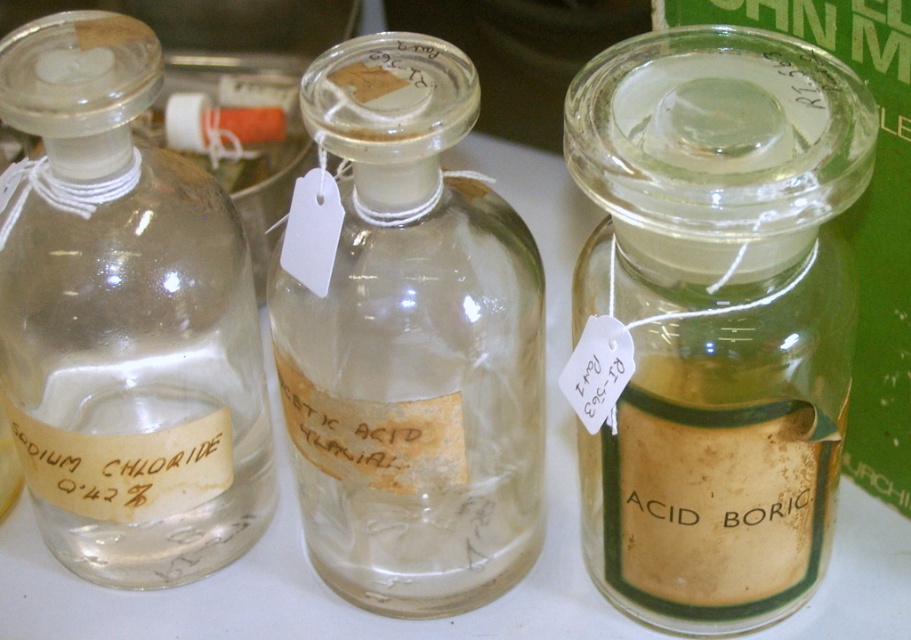
Which is more to the right, transparent glass jar at center or transparent glass bottle at center?

transparent glass jar at center is more to the right.

Who is lower down, transparent glass jar at center or transparent glass bottle at center?

transparent glass jar at center is lower down.

You are a GUI agent. You are given a task and a screenshot of the screen. Output one action in this format:
    pyautogui.click(x=<x>, y=<y>)
    Task: Click on the transparent glass jar at center
    Image resolution: width=911 pixels, height=640 pixels.
    Given the screenshot: What is the action you would take?
    pyautogui.click(x=712, y=317)

Which of these two, transparent glass bottle at center or transparent glass bottle at left, stands taller?

Standing taller between the two is transparent glass bottle at left.

In the scene shown: Does transparent glass bottle at center have a greater height compared to transparent glass bottle at left?

No, transparent glass bottle at center is not taller than transparent glass bottle at left.

Between point (421, 412) and point (57, 140), which one is positioned in front?

Point (57, 140) is in front.

The width and height of the screenshot is (911, 640). Identify the location of transparent glass bottle at center. (408, 340).

Is transparent glass jar at center wider than transparent glass bottle at left?

Correct, the width of transparent glass jar at center exceeds that of transparent glass bottle at left.

In the scene shown: Who is taller, transparent glass jar at center or transparent glass bottle at left?

With more height is transparent glass bottle at left.

Which is in front, point (761, 54) or point (9, 400)?

Positioned in front is point (761, 54).

Find the location of `transparent glass jar at center`. transparent glass jar at center is located at coordinates [x=712, y=317].